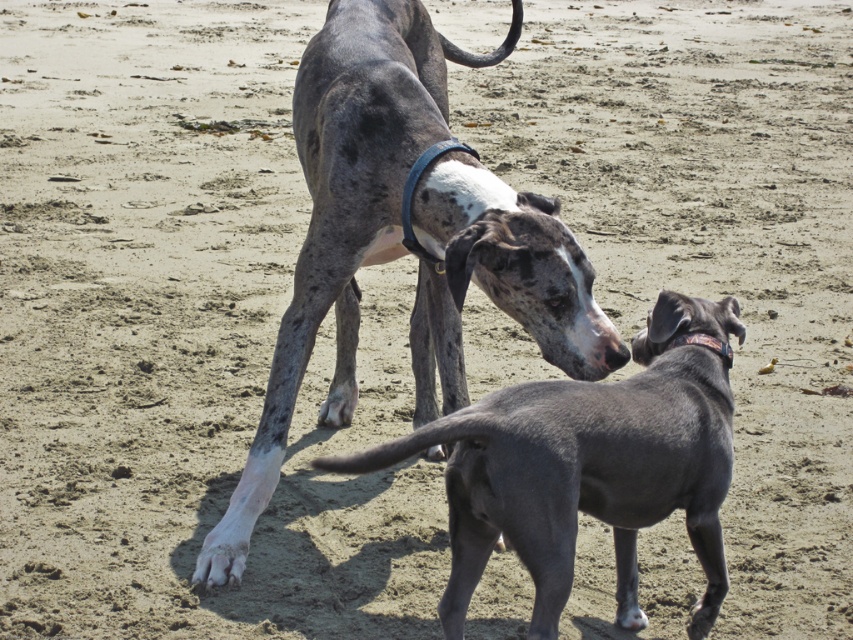
Can you confirm if speckled fur dog at center is positioned to the right of smooth gray dog at center?

In fact, speckled fur dog at center is to the left of smooth gray dog at center.

Looking at this image, which is more to the left, speckled fur dog at center or smooth gray dog at center?

Positioned to the left is speckled fur dog at center.

Image resolution: width=853 pixels, height=640 pixels. What do you see at coordinates (404, 240) in the screenshot?
I see `speckled fur dog at center` at bounding box center [404, 240].

The image size is (853, 640). Find the location of `speckled fur dog at center`. speckled fur dog at center is located at coordinates (404, 240).